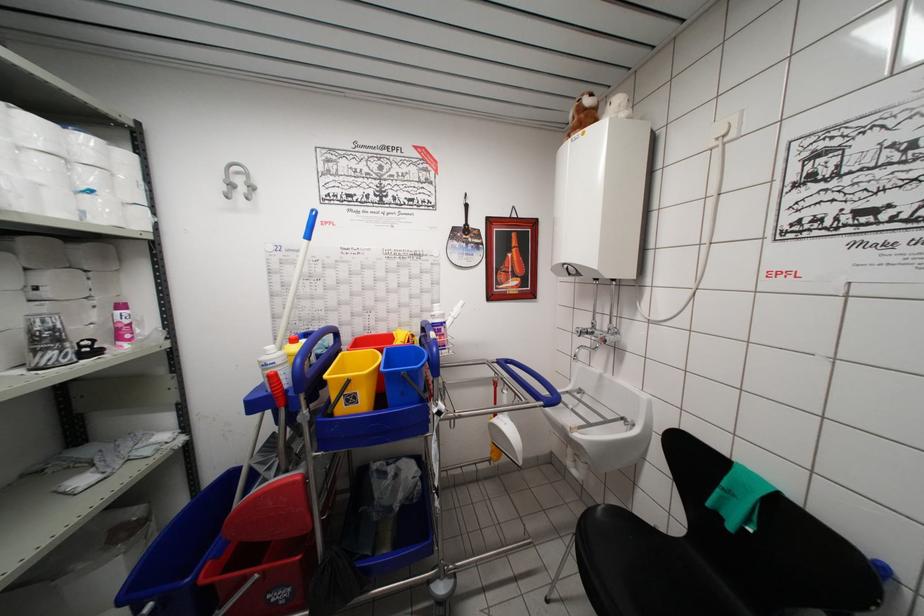
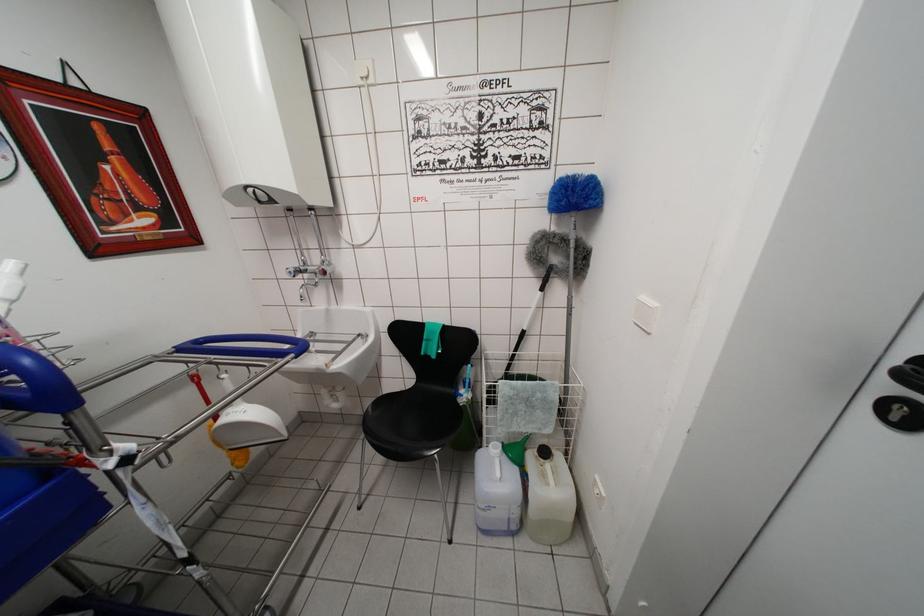
In the second image, find the point that corresponds to pixel 589 428 in the first image.

(338, 360)